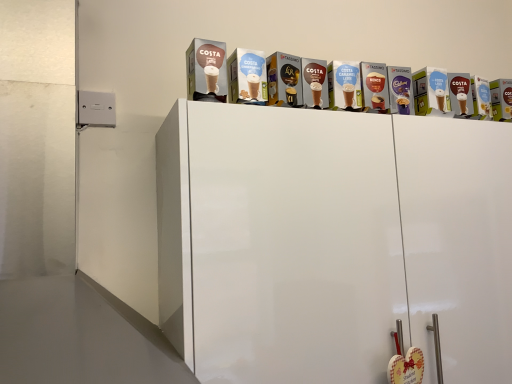
What do you see at coordinates (333, 243) in the screenshot? This screenshot has height=384, width=512. I see `white glossy cabinet at center` at bounding box center [333, 243].

Find the location of a particular element. white glossy cabinet at center is located at coordinates (333, 243).

Image resolution: width=512 pixels, height=384 pixels. I want to click on white glossy cabinet at center, so click(x=333, y=243).